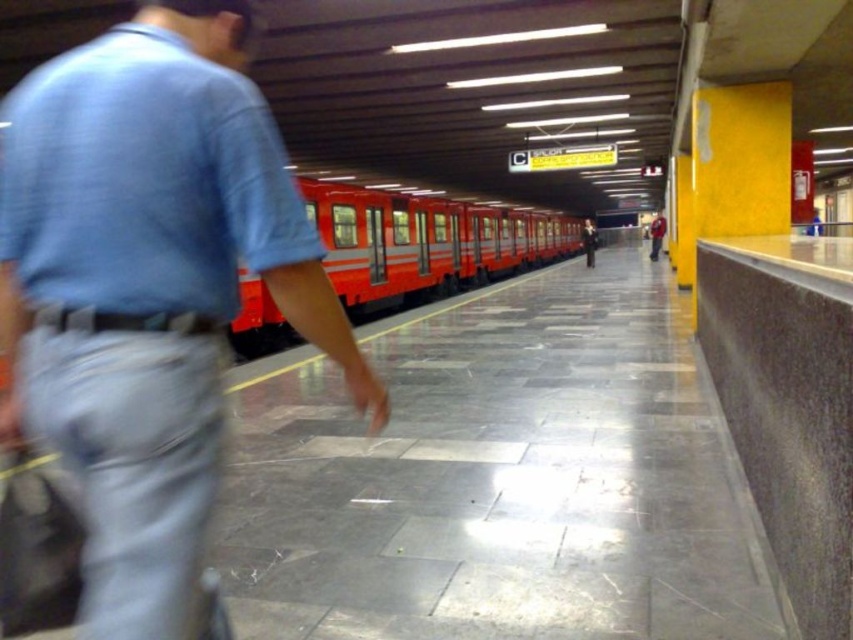
Question: Where is denim jeans at left located in relation to shiny red train at center in the image?

Choices:
 (A) left
 (B) right

Answer: (A)

Question: Which of the following is the farthest from the observer?

Choices:
 (A) (456, 211)
 (B) (115, 348)

Answer: (A)

Question: Which point appears closest to the camera in this image?

Choices:
 (A) (195, 56)
 (B) (334, 282)

Answer: (A)

Question: Is denim jeans at left bigger than shiny red train at center?

Choices:
 (A) yes
 (B) no

Answer: (B)

Question: Can you confirm if denim jeans at left is positioned below shiny red train at center?

Choices:
 (A) yes
 (B) no

Answer: (A)